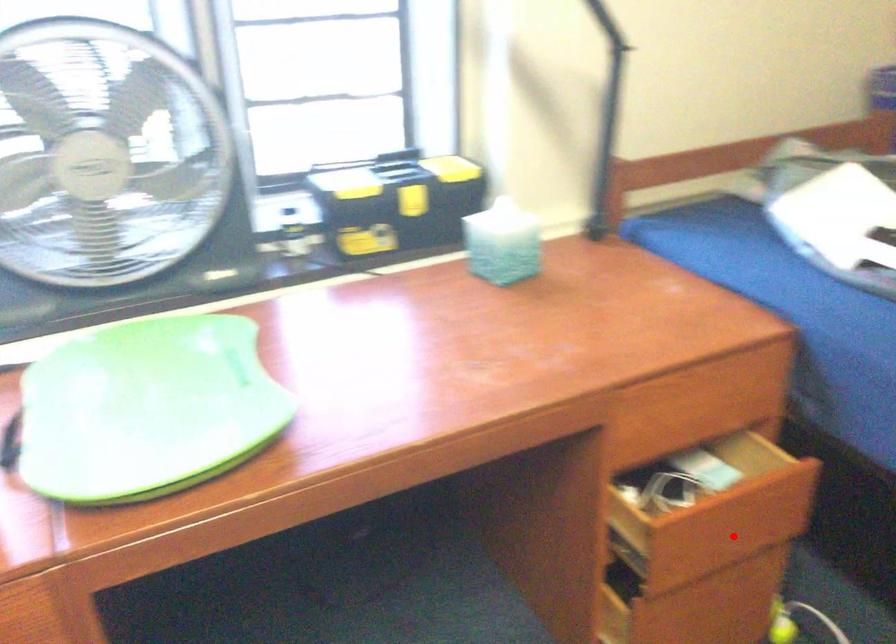
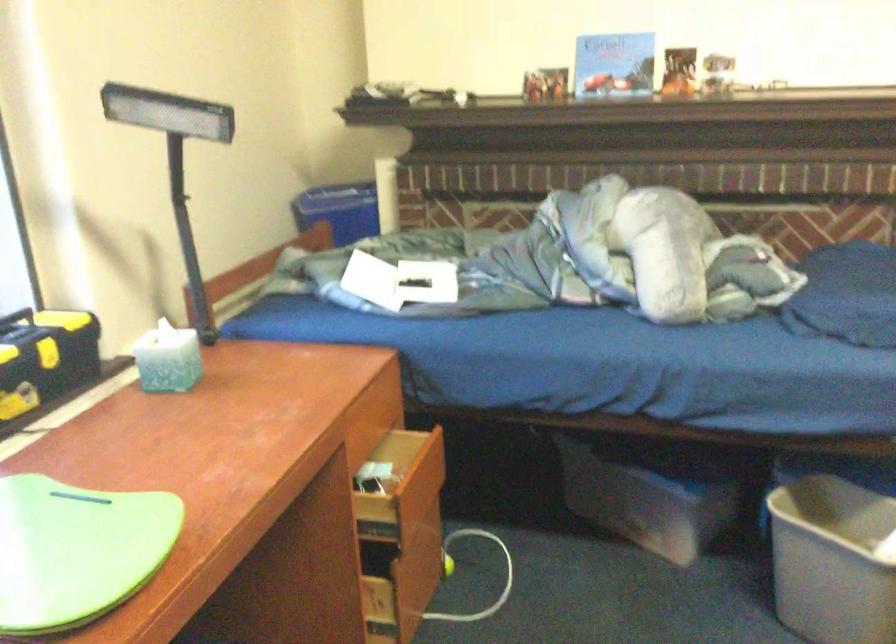
Question: I am providing you with two images of the same scene from different viewpoints. A red point is shown in image1. For the corresponding object point in image2, is it positioned nearer or farther from the camera?

Choices:
 (A) Nearer
 (B) Farther

Answer: (B)